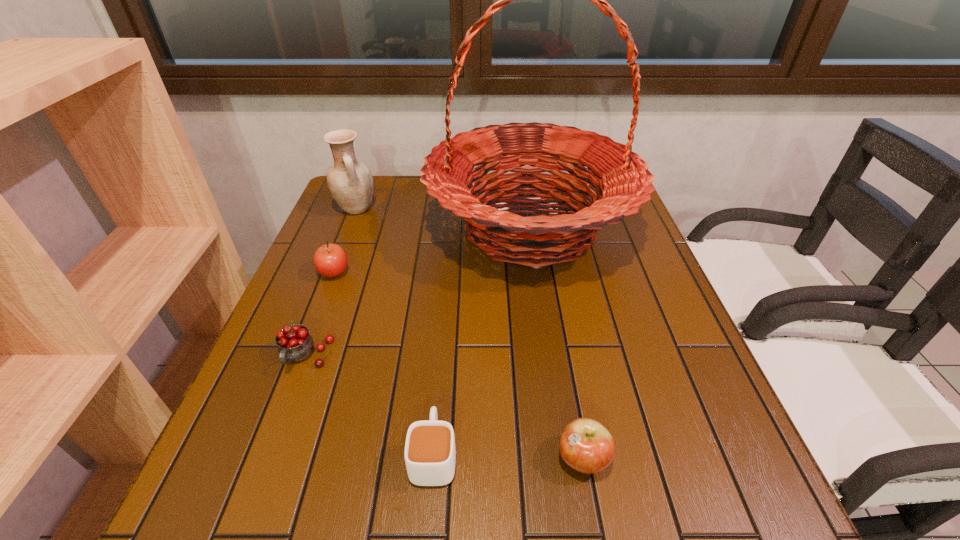
Where is `free region located on the front of the farther apple`? free region located on the front of the farther apple is located at coordinates (324, 301).

At what (x,y) coordinates should I click in order to perform the action: click on vacant space located 0.060m on the handle side of the fourth farthest object. Please return your answer as a coordinate pair (x, y). Looking at the image, I should click on (288, 403).

Locate an element on the screen. This screenshot has height=540, width=960. vacant space located on the left of the nearer apple is located at coordinates (402, 458).

The height and width of the screenshot is (540, 960). Identify the location of vacant space positioned 0.140m on the side with the handle of the cup. (442, 361).

Locate an element on the screen. Image resolution: width=960 pixels, height=540 pixels. free spot located on the side with the handle of the cup is located at coordinates (444, 335).

Find the location of a particular element. free space located on the side with the handle of the cup is located at coordinates (448, 278).

The image size is (960, 540). I want to click on basket located in the far edge section of the desktop, so [621, 178].

Find the location of `pottery at the far edge`. pottery at the far edge is located at coordinates (350, 183).

The width and height of the screenshot is (960, 540). Find the location of `apple that is at the near edge`. apple that is at the near edge is located at coordinates (585, 445).

I want to click on cup at the near edge, so click(x=430, y=455).